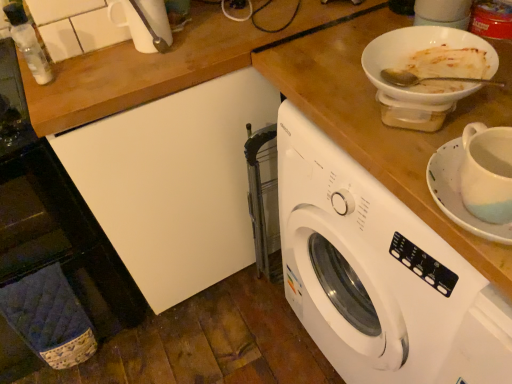
Question: Considering the positions of white ceramic saucer at right and white plastic washing machine at center in the image, is white ceramic saucer at right taller or shorter than white plastic washing machine at center?

Choices:
 (A) short
 (B) tall

Answer: (A)

Question: From the image's perspective, relative to white plastic washing machine at center, is white ceramic saucer at right above or below?

Choices:
 (A) below
 (B) above

Answer: (B)

Question: Which is farther from the white glossy bowl at upper right?

Choices:
 (A) white ceramic saucer at right
 (B) transparent plastic bottle at upper left
 (C) white plastic washing machine at center

Answer: (B)

Question: Estimate the real-world distances between objects in this image. Which object is closer to the white plastic washing machine at center?

Choices:
 (A) white glossy bowl at upper right
 (B) transparent plastic bottle at upper left
 (C) white ceramic saucer at right

Answer: (C)